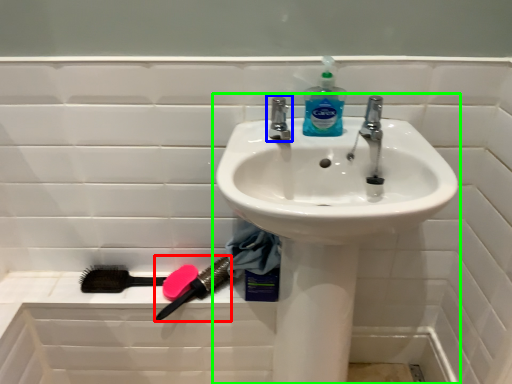
Question: Which is nearer to the brush (highlighted by a red box)? tap (highlighted by a blue box) or sink (highlighted by a green box).

Choices:
 (A) tap
 (B) sink

Answer: (B)